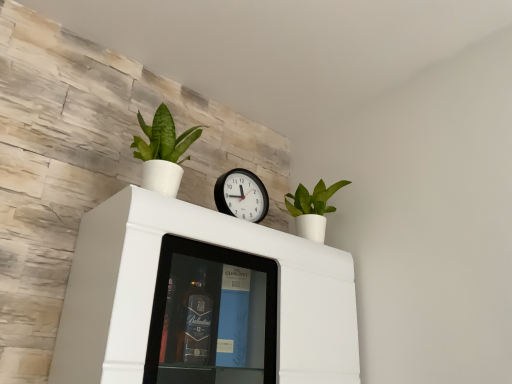
Locate an element on the screen. The width and height of the screenshot is (512, 384). green matte plant at upper left, acting as the first houseplant starting from the left is located at coordinates (163, 152).

Where is `green matte plant at upper right, positioned as the 1th houseplant in right-to-left order`? The image size is (512, 384). green matte plant at upper right, positioned as the 1th houseplant in right-to-left order is located at coordinates (312, 209).

Which of these two, black plastic wall clock at center or green matte plant at upper right, arranged as the 2th houseplant when viewed from the front, is wider?

With larger width is green matte plant at upper right, arranged as the 2th houseplant when viewed from the front.

From the image's perspective, who appears lower, black plastic wall clock at center or green matte plant at upper right, the first houseplant in the back-to-front sequence?

From the image's view, green matte plant at upper right, the first houseplant in the back-to-front sequence, is below.

Is black plastic wall clock at center at the right side of green matte plant at upper right, arranged as the 2th houseplant when viewed from the front?

In fact, black plastic wall clock at center is to the left of green matte plant at upper right, arranged as the 2th houseplant when viewed from the front.

Is point (251, 173) more distant than point (316, 193)?

No.

Based on the photo, from the image's perspective, is green matte plant at upper left, acting as the first houseplant starting from the left, located beneath black plastic wall clock at center?

Actually, green matte plant at upper left, acting as the first houseplant starting from the left, appears above black plastic wall clock at center in the image.

Could you tell me if green matte plant at upper left, acting as the first houseplant starting from the left, is facing black plastic wall clock at center?

No, green matte plant at upper left, acting as the first houseplant starting from the left, is not turned towards black plastic wall clock at center.

Is green matte plant at upper left, acting as the first houseplant starting from the left, far from black plastic wall clock at center?

No, green matte plant at upper left, acting as the first houseplant starting from the left, is not far from black plastic wall clock at center.

Does green matte plant at upper left, which appears as the 1th houseplant when viewed from the front, turn towards white matte cabinet at upper center?

No, green matte plant at upper left, which appears as the 1th houseplant when viewed from the front, is not aimed at white matte cabinet at upper center.

Is white matte cabinet at upper center surrounded by green matte plant at upper left, which appears as the 1th houseplant when viewed from the front?

No, white matte cabinet at upper center is located outside of green matte plant at upper left, which appears as the 1th houseplant when viewed from the front.

Can you confirm if green matte plant at upper left, which is the second houseplant in back-to-front order, is shorter than white matte cabinet at upper center?

Yes, green matte plant at upper left, which is the second houseplant in back-to-front order, is shorter than white matte cabinet at upper center.

Based on their sizes in the image, would you say green matte plant at upper left, the second houseplant viewed from the right, is bigger or smaller than white matte cabinet at upper center?

In the image, green matte plant at upper left, the second houseplant viewed from the right, appears to be smaller than white matte cabinet at upper center.

Between green matte plant at upper right, the first houseplant in the back-to-front sequence, and black plastic wall clock at center, which one appears on the right side from the viewer's perspective?

Positioned to the right is green matte plant at upper right, the first houseplant in the back-to-front sequence.

Is the depth of green matte plant at upper right, the first houseplant in the back-to-front sequence, greater than that of black plastic wall clock at center?

Yes.

Considering the positions of points (319, 201) and (249, 203), is point (319, 201) closer to camera compared to point (249, 203)?

No.

Which of these two, green matte plant at upper right, positioned as the 1th houseplant in right-to-left order, or black plastic wall clock at center, stands taller?

green matte plant at upper right, positioned as the 1th houseplant in right-to-left order, is taller.

Is point (255, 180) positioned before point (163, 121)?

No, it is behind (163, 121).

Are black plastic wall clock at center and green matte plant at upper left, acting as the first houseplant starting from the left, beside each other?

No, black plastic wall clock at center is not in contact with green matte plant at upper left, acting as the first houseplant starting from the left.

Find the location of a particular element. The width and height of the screenshot is (512, 384). wall clock behind the green matte plant at upper left, which appears as the 1th houseplant when viewed from the front is located at coordinates (241, 195).

From a real-world perspective, does white matte cabinet at upper center sit lower than black plastic wall clock at center?

Yes, from a real-world perspective, white matte cabinet at upper center is below black plastic wall clock at center.

Is white matte cabinet at upper center far from black plastic wall clock at center?

white matte cabinet at upper center is actually quite close to black plastic wall clock at center.

Is black plastic wall clock at center at the back of white matte cabinet at upper center?

No, white matte cabinet at upper center's orientation is not away from black plastic wall clock at center.

Is white matte cabinet at upper center closer to camera compared to black plastic wall clock at center?

That is True.

From the image's perspective, is green matte plant at upper right, arranged as the 2th houseplant when viewed from the front, on top of green matte plant at upper left, the second houseplant viewed from the right?

No, from the image's perspective, green matte plant at upper right, arranged as the 2th houseplant when viewed from the front, is not over green matte plant at upper left, the second houseplant viewed from the right.

Is green matte plant at upper left, the second houseplant viewed from the right, a part of green matte plant at upper right, arranged as the 2th houseplant when viewed from the front?

Definitely not — green matte plant at upper left, the second houseplant viewed from the right, is not inside green matte plant at upper right, arranged as the 2th houseplant when viewed from the front.

From a real-world perspective, between green matte plant at upper right, positioned as the 1th houseplant in right-to-left order, and green matte plant at upper left, acting as the first houseplant starting from the left, who is vertically lower?

green matte plant at upper left, acting as the first houseplant starting from the left, from a real-world perspective.

Locate an element on the screen. This screenshot has height=384, width=512. houseplant below the green matte plant at upper right, positioned as the 1th houseplant in right-to-left order (from a real-world perspective) is located at coordinates (163, 152).

In the image, there is a green matte plant at upper right, arranged as the 2th houseplant when viewed from the front. Where is `wall clock below it (from a real-world perspective)`? wall clock below it (from a real-world perspective) is located at coordinates (241, 195).

Identify the location of wall clock on the right of the green matte plant at upper left, acting as the first houseplant starting from the left. (241, 195).

From the image, which object appears to be nearer to white matte cabinet at upper center, green matte plant at upper right, marked as the second houseplant in a left-to-right arrangement, or black plastic wall clock at center?

The object closer to white matte cabinet at upper center is black plastic wall clock at center.

Considering their positions, is black plastic wall clock at center positioned further to green matte plant at upper right, the first houseplant in the back-to-front sequence, than white matte cabinet at upper center?

white matte cabinet at upper center is positioned further to the anchor green matte plant at upper right, the first houseplant in the back-to-front sequence.

Based on their spatial positions, is black plastic wall clock at center or green matte plant at upper right, arranged as the 2th houseplant when viewed from the front, further from green matte plant at upper left, which appears as the 1th houseplant when viewed from the front?

green matte plant at upper right, arranged as the 2th houseplant when viewed from the front, is further to green matte plant at upper left, which appears as the 1th houseplant when viewed from the front.

When comparing their distances from white matte cabinet at upper center, does green matte plant at upper right, marked as the second houseplant in a left-to-right arrangement, or green matte plant at upper left, which appears as the 1th houseplant when viewed from the front, seem closer?

Based on the image, green matte plant at upper left, which appears as the 1th houseplant when viewed from the front, appears to be nearer to white matte cabinet at upper center.

In the scene shown: Looking at the image, which one is located further to white matte cabinet at upper center, green matte plant at upper left, which is the second houseplant in back-to-front order, or green matte plant at upper right, marked as the second houseplant in a left-to-right arrangement?

green matte plant at upper right, marked as the second houseplant in a left-to-right arrangement, is further to white matte cabinet at upper center.

Which object lies nearer to the anchor point black plastic wall clock at center, white matte cabinet at upper center or green matte plant at upper right, the first houseplant in the back-to-front sequence?

green matte plant at upper right, the first houseplant in the back-to-front sequence, lies closer to black plastic wall clock at center than the other object.

Based on their spatial positions, is black plastic wall clock at center or white matte cabinet at upper center closer to green matte plant at upper left, acting as the first houseplant starting from the left?

black plastic wall clock at center is closer to green matte plant at upper left, acting as the first houseplant starting from the left.

Estimate the real-world distances between objects in this image. Which object is closer to white matte cabinet at upper center, green matte plant at upper left, which appears as the 1th houseplant when viewed from the front, or black plastic wall clock at center?

The object closer to white matte cabinet at upper center is black plastic wall clock at center.

What are the coordinates of `wall clock positioned between white matte cabinet at upper center and green matte plant at upper right, arranged as the 2th houseplant when viewed from the front, from near to far` in the screenshot? It's located at (241, 195).

What are the coordinates of `wall clock between green matte plant at upper left, which is the second houseplant in back-to-front order, and green matte plant at upper right, arranged as the 2th houseplant when viewed from the front, in the horizontal direction` in the screenshot? It's located at (241, 195).

You are a GUI agent. You are given a task and a screenshot of the screen. Output one action in this format:
    pyautogui.click(x=<x>, y=<y>)
    Task: Click on the wall clock between green matte plant at upper left, which appears as the 1th houseplant when viewed from the front, and white matte cabinet at upper center vertically
    
    Given the screenshot: What is the action you would take?
    pyautogui.click(x=241, y=195)

You are a GUI agent. You are given a task and a screenshot of the screen. Output one action in this format:
    pyautogui.click(x=<x>, y=<y>)
    Task: Click on the houseplant between white matte cabinet at upper center and green matte plant at upper right, the first houseplant in the back-to-front sequence, along the z-axis
    This screenshot has width=512, height=384.
    Given the screenshot: What is the action you would take?
    (163, 152)